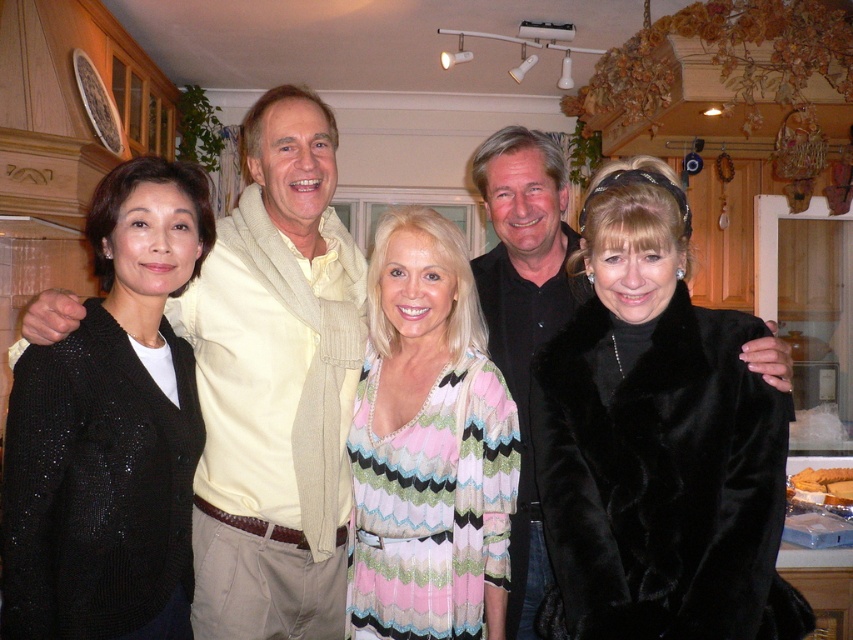
Question: Can you confirm if black fur coat at center is thinner than black sequined cardigan at left?

Choices:
 (A) yes
 (B) no

Answer: (B)

Question: Which of the following is the closest to the observer?

Choices:
 (A) (163, 445)
 (B) (479, 321)
 (C) (49, 326)
 (D) (546, 145)

Answer: (C)

Question: Is black sequined cardigan at left further to the viewer compared to black velvet shirt at center?

Choices:
 (A) no
 (B) yes

Answer: (A)

Question: Does black fur coat at center have a larger size compared to black velvet shirt at center?

Choices:
 (A) no
 (B) yes

Answer: (A)

Question: Estimate the real-world distances between objects in this image. Which object is farther from the black velvet shirt at center?

Choices:
 (A) black fur coat at center
 (B) black sequined cardigan at left

Answer: (B)

Question: Which object appears farthest from the camera in this image?

Choices:
 (A) striped knit dress at center
 (B) black sequined cardigan at left
 (C) light beige sweater at left

Answer: (C)